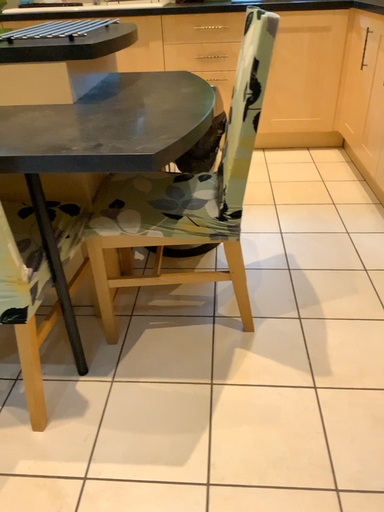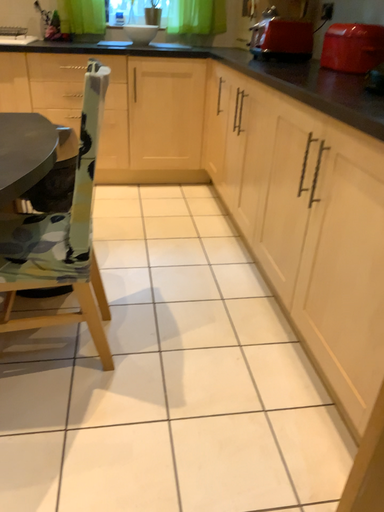
Question: How did the camera likely rotate when shooting the video?

Choices:
 (A) rotated left
 (B) rotated right

Answer: (B)